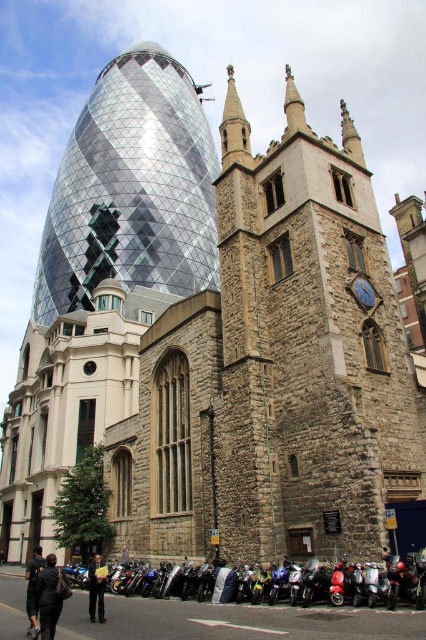
Who is lower down, shiny glass tower at center or dark gray jacket at center?

Positioned lower is dark gray jacket at center.

Does shiny glass tower at center appear under dark gray jacket at center?

Incorrect, shiny glass tower at center is not positioned below dark gray jacket at center.

From the picture: Who is more distant from viewer, (83, 259) or (126, 563)?

Positioned behind is point (83, 259).

Locate an element on the screen. The height and width of the screenshot is (640, 426). shiny glass tower at center is located at coordinates (132, 189).

What do you see at coordinates (132, 189) in the screenshot? I see `shiny glass tower at center` at bounding box center [132, 189].

Is shiny glass tower at center behind dark blue jacket at lower left?

Yes, shiny glass tower at center is behind dark blue jacket at lower left.

Between point (192, 188) and point (34, 560), which one is positioned behind?

The point (192, 188) is more distant.

Find the location of `shiny glass tower at center`. shiny glass tower at center is located at coordinates (132, 189).

Between point (43, 604) and point (34, 624), which one is positioned in front?

Point (43, 604)

At what (x,y) coordinates should I click in order to perform the action: click on dark gray suit at lower left. Please return your answer as a coordinate pair (x, y). This screenshot has width=426, height=640. Looking at the image, I should click on (49, 596).

Which is behind, point (51, 620) or point (26, 566)?

Point (26, 566)

Locate an element on the screen. This screenshot has height=640, width=426. dark gray suit at lower left is located at coordinates (49, 596).